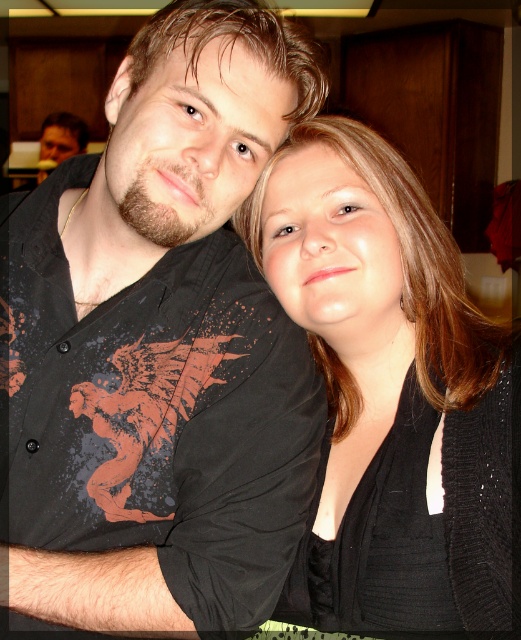
Question: Is black matte shirt at upper left closer to the viewer compared to black knitwear at center?

Choices:
 (A) no
 (B) yes

Answer: (B)

Question: Where is black matte shirt at upper left located in relation to black knitwear at center in the image?

Choices:
 (A) left
 (B) right

Answer: (A)

Question: Which object appears farthest from the camera in this image?

Choices:
 (A) black knitwear at center
 (B) black matte shirt at upper left

Answer: (A)

Question: Does black matte shirt at upper left come in front of black knitwear at center?

Choices:
 (A) yes
 (B) no

Answer: (A)